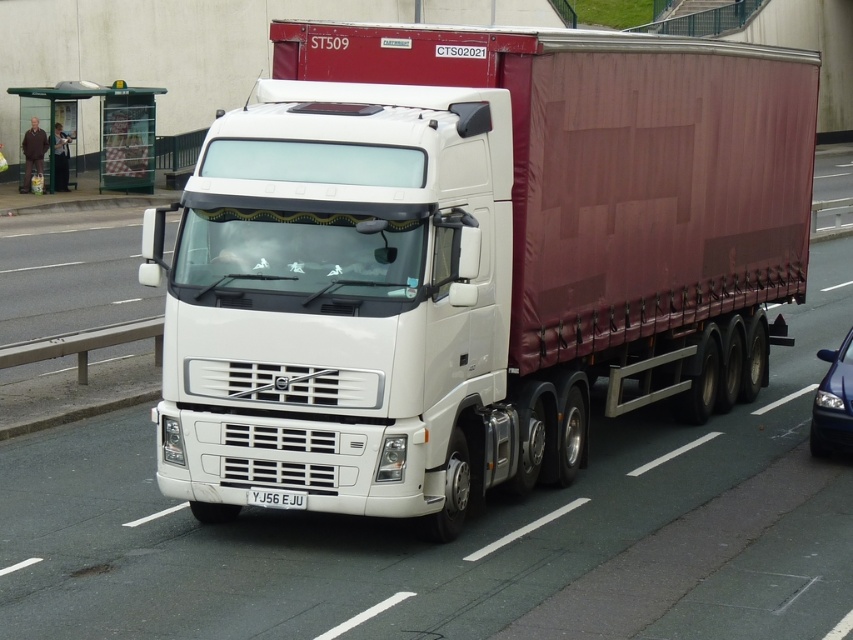
Question: Among these points, which one is farthest from the camera?

Choices:
 (A) (386, 467)
 (B) (822, 355)
 (C) (302, 499)

Answer: (B)

Question: Which point is closer to the camera?

Choices:
 (A) glossy blue car at right
 (B) white plastic license plate at center
 (C) white matte truck at center

Answer: (C)

Question: Can you confirm if white matte truck at center is positioned to the left of glossy blue car at right?

Choices:
 (A) no
 (B) yes

Answer: (B)

Question: Is the position of white matte truck at center less distant than that of white plastic license plate at center?

Choices:
 (A) no
 (B) yes

Answer: (B)

Question: Considering the real-world distances, which object is closest to the white matte truck at center?

Choices:
 (A) glossy blue car at right
 (B) white plastic license plate at center

Answer: (B)

Question: Can you confirm if glossy blue car at right is thinner than white plastic license plate at center?

Choices:
 (A) yes
 (B) no

Answer: (B)